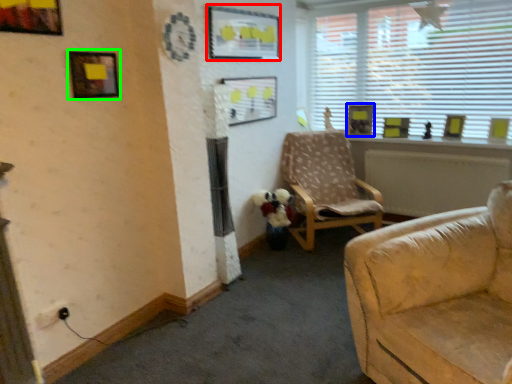
Question: Which object is the farthest from picture frame (highlighted by a red box)? Choose among these: picture frame (highlighted by a blue box) or picture frame (highlighted by a green box).

Choices:
 (A) picture frame
 (B) picture frame

Answer: (A)